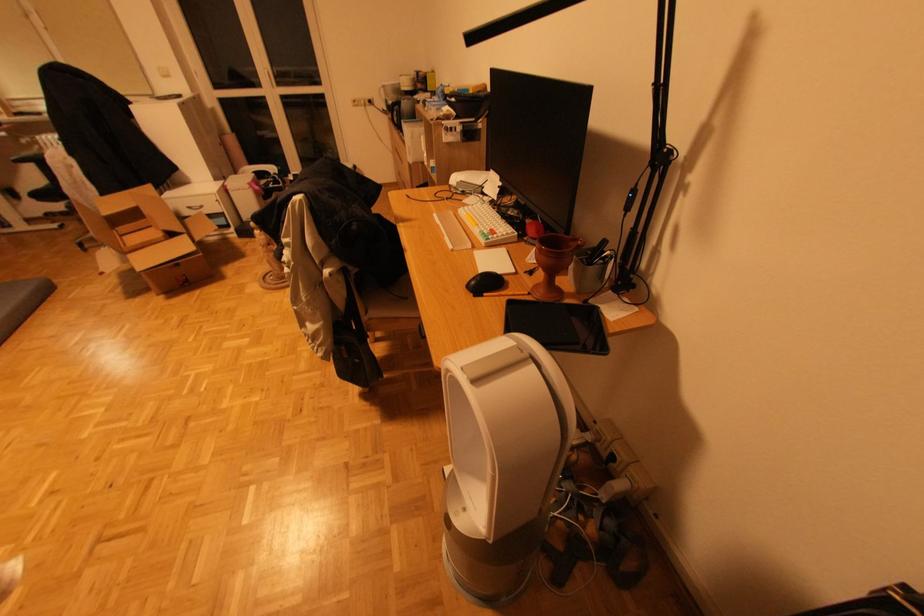
I want to click on cardboard box flap, so click(91, 225).